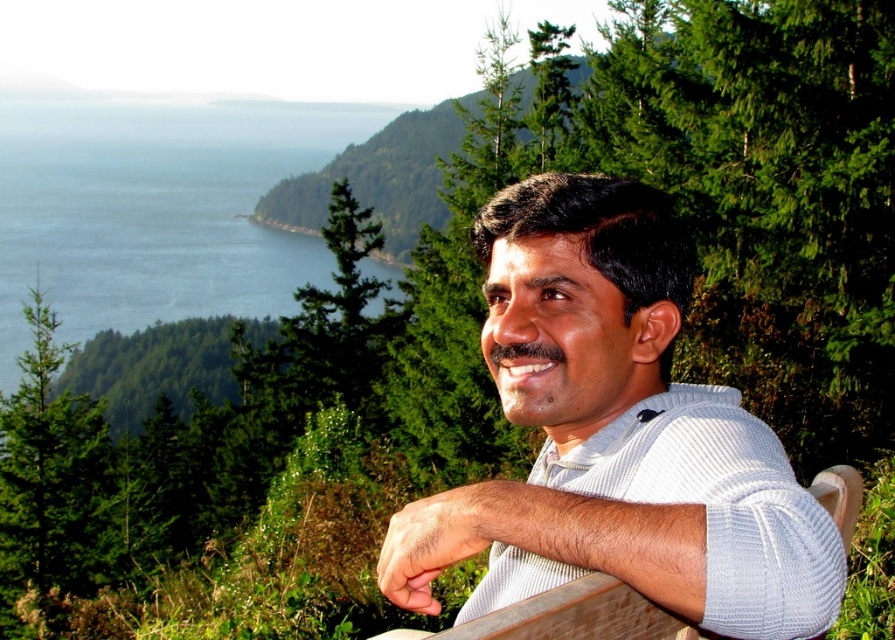
Question: Is white ribbed sweater at center further to camera compared to blue water at upper left?

Choices:
 (A) no
 (B) yes

Answer: (A)

Question: Can you confirm if white ribbed sweater at center is positioned to the right of blue water at upper left?

Choices:
 (A) no
 (B) yes

Answer: (B)

Question: Which point appears farthest from the camera in this image?

Choices:
 (A) (526, 416)
 (B) (246, 106)

Answer: (B)

Question: Is white ribbed sweater at center further to the viewer compared to blue water at upper left?

Choices:
 (A) yes
 (B) no

Answer: (B)

Question: Which point is closer to the camera?

Choices:
 (A) (649, 378)
 (B) (250, 260)

Answer: (A)